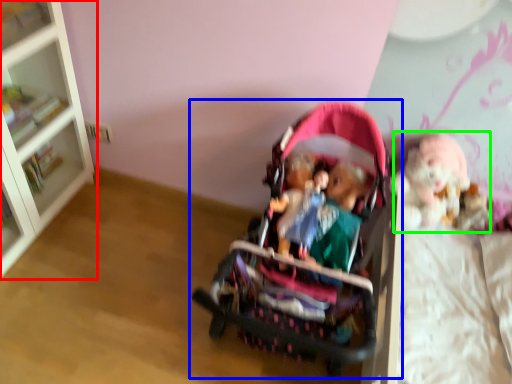
Question: Based on their relative distances, which object is nearer to bookcase (highlighted by a red box)? Choose from toy (highlighted by a blue box) and doll (highlighted by a green box).

Choices:
 (A) toy
 (B) doll

Answer: (A)